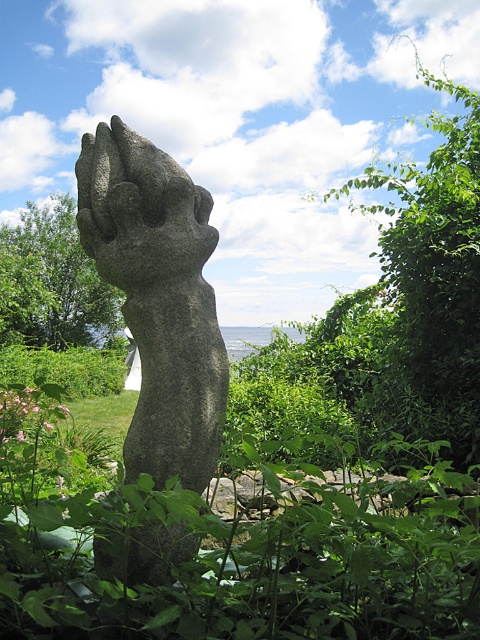
Question: Among these points, which one is farthest from the camera?

Choices:
 (A) (22, 336)
 (B) (193, 424)

Answer: (A)

Question: Among these points, which one is nearest to the camera?

Choices:
 (A) (11, 230)
 (B) (200, 216)

Answer: (B)

Question: Does gray stone hand at center have a larger size compared to green leafy bush at center?

Choices:
 (A) yes
 (B) no

Answer: (B)

Question: In this image, where is gray stone hand at center located relative to green leafy bush at center?

Choices:
 (A) right
 (B) left

Answer: (A)

Question: Is gray stone hand at center to the right of green leafy bush at center from the viewer's perspective?

Choices:
 (A) no
 (B) yes

Answer: (B)

Question: Which point is farther from the camera taking this photo?

Choices:
 (A) (31, 220)
 (B) (124, 316)

Answer: (A)